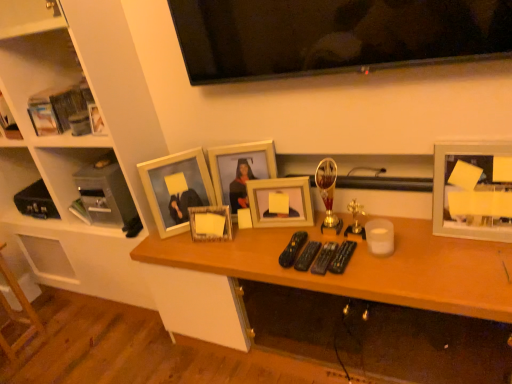
At what (x,y) coordinates should I click in order to perform the action: click on free space above wooden desk at center (from a real-world perspective). Please return your answer as a coordinate pair (x, y). Looking at the image, I should click on (338, 241).